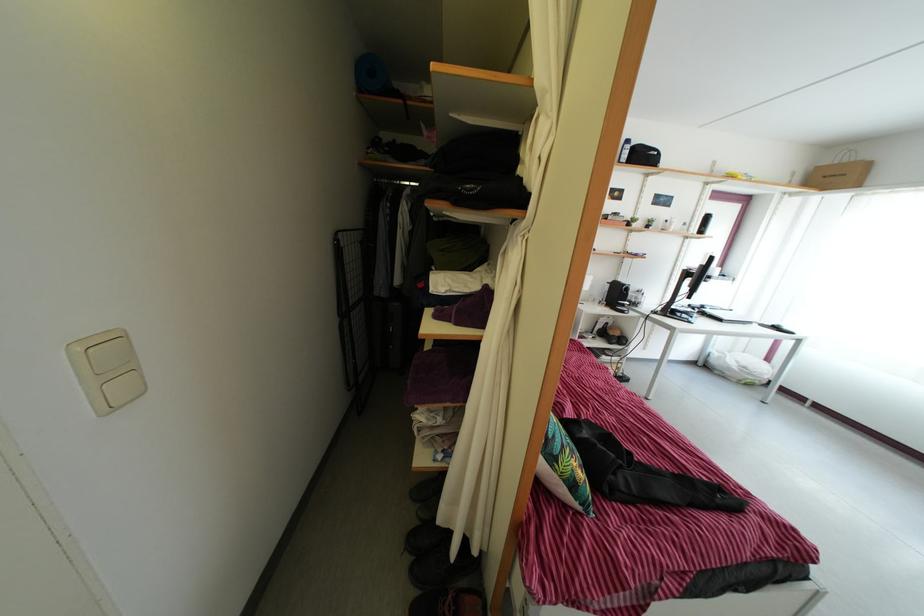
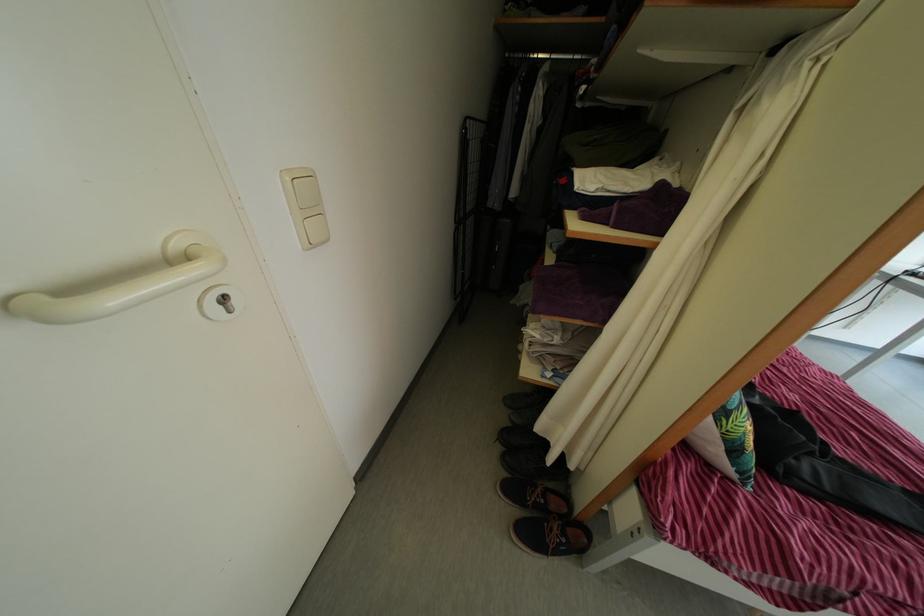
Find the pixel in the second image that matches pixel 415 567 in the first image.

(505, 456)